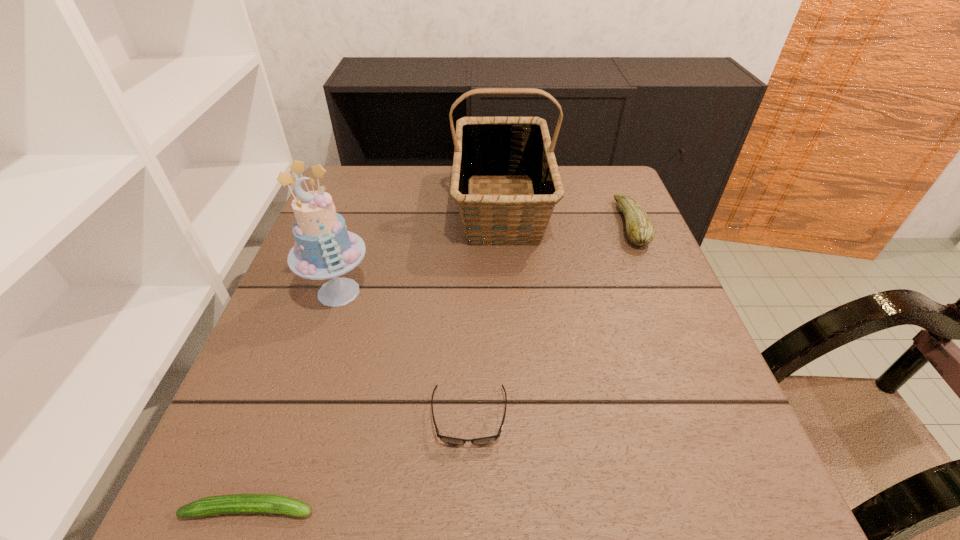
You are a GUI agent. You are given a task and a screenshot of the screen. Output one action in this format:
    pyautogui.click(x=<x>, y=<y>)
    Task: Click on the vacant space located at the stem end of the rightmost object
    The width and height of the screenshot is (960, 540).
    Given the screenshot: What is the action you would take?
    pyautogui.click(x=495, y=225)

Locate an element on the screen. The width and height of the screenshot is (960, 540). vacant point located at the stem end of the rightmost object is located at coordinates (484, 225).

Image resolution: width=960 pixels, height=540 pixels. In order to click on vacant space located at the stem end of the rightmost object in this screenshot , I will do `click(499, 225)`.

You are a GUI agent. You are given a task and a screenshot of the screen. Output one action in this format:
    pyautogui.click(x=<x>, y=<y>)
    Task: Click on the free space located 0.050m on the front-facing side of the second shortest object
    
    Given the screenshot: What is the action you would take?
    pyautogui.click(x=468, y=482)

Image resolution: width=960 pixels, height=540 pixels. Identify the location of blank area located on the front-facing side of the nearest object. (577, 509).

Find the location of a particular element. basket at the far edge is located at coordinates (485, 147).

At what (x,y) coordinates should I click in order to perform the action: click on zucchini that is at the far edge. Please return your answer as a coordinate pair (x, y). The image size is (960, 540). Looking at the image, I should click on (640, 230).

Where is `object that is at the near edge`? Image resolution: width=960 pixels, height=540 pixels. object that is at the near edge is located at coordinates (236, 503).

You are a GUI agent. You are given a task and a screenshot of the screen. Output one action in this format:
    pyautogui.click(x=<x>, y=<y>)
    Task: Click on the cake present at the left edge
    
    Given the screenshot: What is the action you would take?
    tap(324, 248)

Locate an element on the screen. Image resolution: width=960 pixels, height=540 pixels. zucchini present at the left edge is located at coordinates (236, 503).